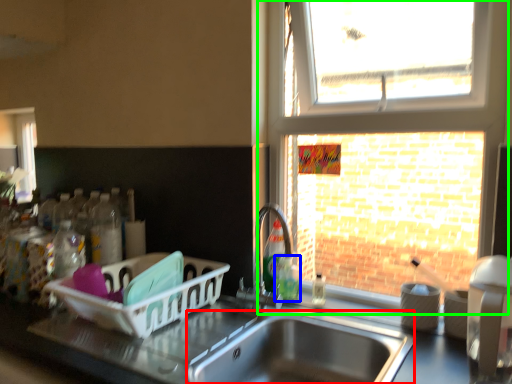
Question: Considering the real-world distances, which object is farthest from sink (highlighted by a red box)? bottle (highlighted by a blue box) or window (highlighted by a green box)?

Choices:
 (A) bottle
 (B) window

Answer: (B)